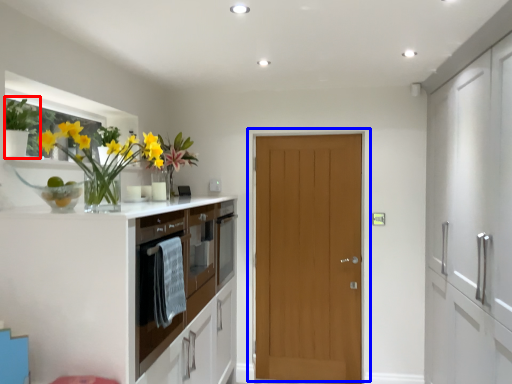
Question: Which object is closer to the camera taking this photo, plant (highlighted by a red box) or door (highlighted by a blue box)?

Choices:
 (A) plant
 (B) door

Answer: (A)